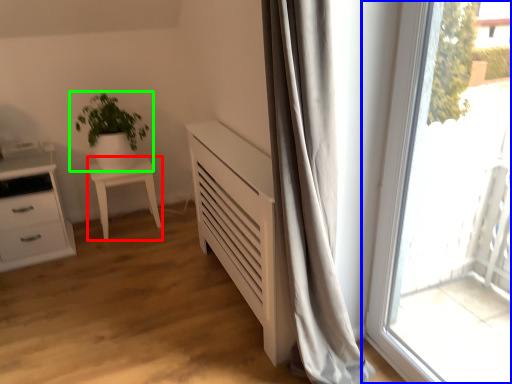
Question: Which object is the closest to the furniture (highlighted by a red box)? Choose among these: window (highlighted by a blue box) or houseplant (highlighted by a green box).

Choices:
 (A) window
 (B) houseplant

Answer: (B)